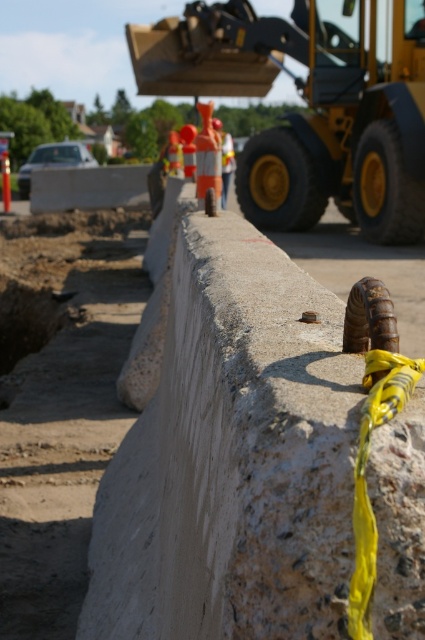
Question: Is yellow rubber excavator at upper center thinner than orange reflective vest at center?

Choices:
 (A) yes
 (B) no

Answer: (B)

Question: Which point is farther to the camera?

Choices:
 (A) [232, 156]
 (B) [353, 132]

Answer: (A)

Question: Observing the image, what is the correct spatial positioning of yellow rubber excavator at upper center in reference to orange reflective vest at center?

Choices:
 (A) right
 (B) left

Answer: (A)

Question: Can you confirm if yellow rubber excavator at upper center is bigger than orange reflective vest at center?

Choices:
 (A) yes
 (B) no

Answer: (B)

Question: Which point is farther from the camera taking this photo?

Choices:
 (A) (217, 120)
 (B) (184, 36)

Answer: (B)